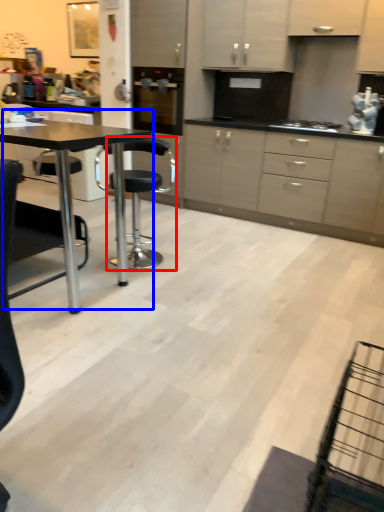
Question: Among these objects, which one is nearest to the camera, chair (highlighted by a red box) or table (highlighted by a blue box)?

Choices:
 (A) chair
 (B) table

Answer: (B)